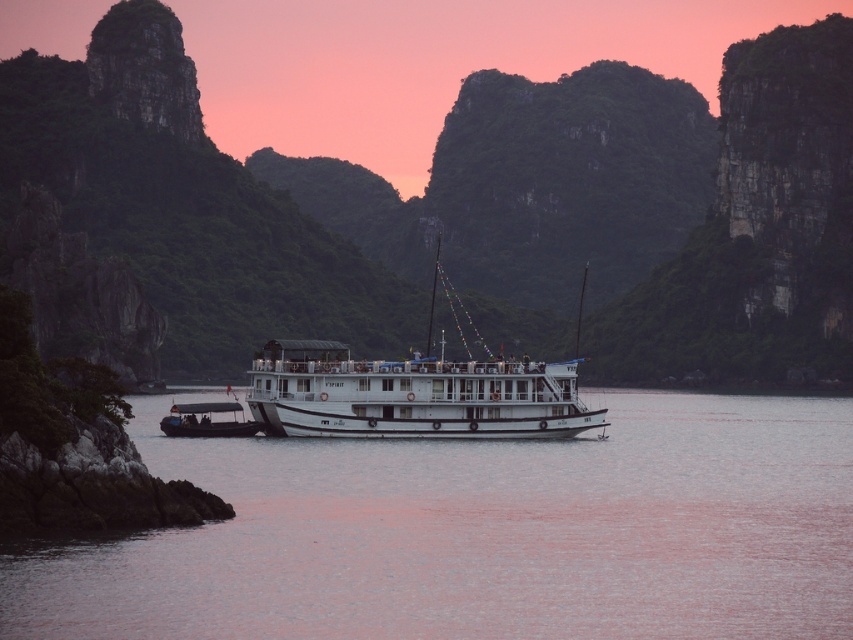
Question: Is white matte cruise ship at center above black rubber dinghy at lower left?

Choices:
 (A) no
 (B) yes

Answer: (B)

Question: Which object appears closest to the camera in this image?

Choices:
 (A) white matte cruise ship at center
 (B) clear water at center

Answer: (B)

Question: Which object is positioned closest to the white matte cruise ship at center?

Choices:
 (A) black rubber dinghy at lower left
 (B) clear water at center

Answer: (A)

Question: Is clear water at center below black rubber dinghy at lower left?

Choices:
 (A) yes
 (B) no

Answer: (A)

Question: Does clear water at center appear on the right side of white matte cruise ship at center?

Choices:
 (A) yes
 (B) no

Answer: (B)

Question: Which point is farther from the camera taking this photo?

Choices:
 (A) (242, 524)
 (B) (177, 404)

Answer: (B)